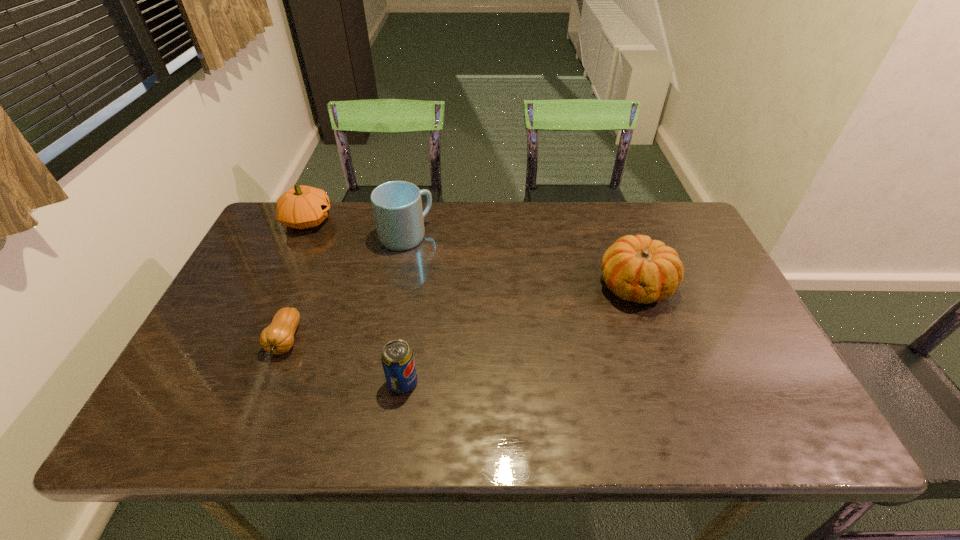
Identify the location of vacant region that satisfies the following two spatial constraints: 1. on the side of the farthest gourd with the carved face; 2. on the left side of the nearest object. The width and height of the screenshot is (960, 540). (232, 382).

The width and height of the screenshot is (960, 540). In order to click on free space that satisfies the following two spatial constraints: 1. on the side of the farthest gourd with the carved face; 2. on the right side of the rightmost gourd in this screenshot , I will do `click(277, 286)`.